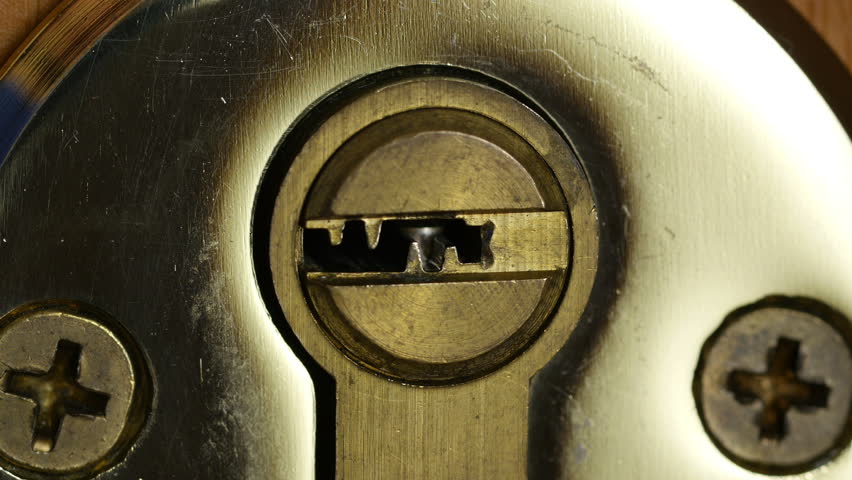
You are a GUI agent. You are given a task and a screenshot of the screen. Output one action in this format:
    pyautogui.click(x=<x>, y=<y>)
    Task: Click on the lock
    This screenshot has width=852, height=480.
    Given the screenshot: What is the action you would take?
    pyautogui.click(x=438, y=304)